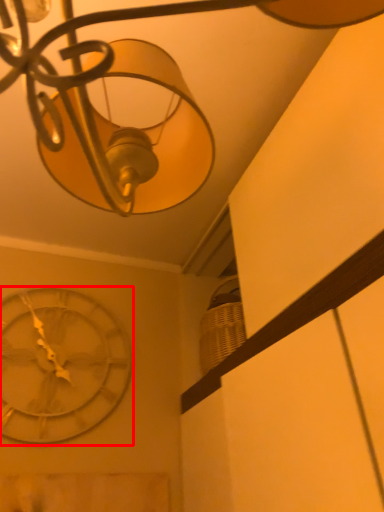
Question: From the image's perspective, where is wall clock (annotated by the red box) located relative to lamp?

Choices:
 (A) below
 (B) above

Answer: (A)